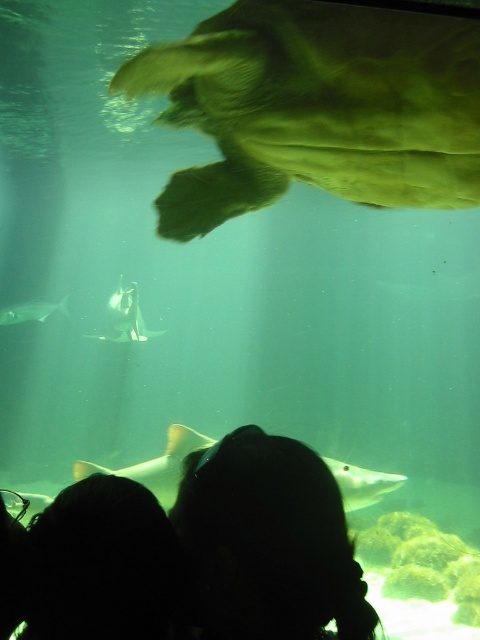
Question: Which of the following is the closest to the observer?

Choices:
 (A) (261, 568)
 (B) (239, 180)
 (C) (116, 332)
 (D) (93, 570)

Answer: (D)

Question: Observing the image, what is the correct spatial positioning of silhouette hair at lower center in reference to shiny silver shark at lower left?

Choices:
 (A) below
 (B) above

Answer: (A)

Question: Which object appears closest to the camera in this image?

Choices:
 (A) silhouette hair at lower left
 (B) silhouette hair at lower center
 (C) translucent gray shark at center
 (D) shiny silver shark at lower left

Answer: (A)

Question: Does greenish translucent turtle at upper center appear on the left side of silhouette hair at lower left?

Choices:
 (A) yes
 (B) no

Answer: (B)

Question: Does greenish translucent turtle at upper center come behind shiny silver shark at lower left?

Choices:
 (A) yes
 (B) no

Answer: (B)

Question: Which point appears farthest from the camera in this image?

Choices:
 (A) (300, 483)
 (B) (2, 316)

Answer: (B)